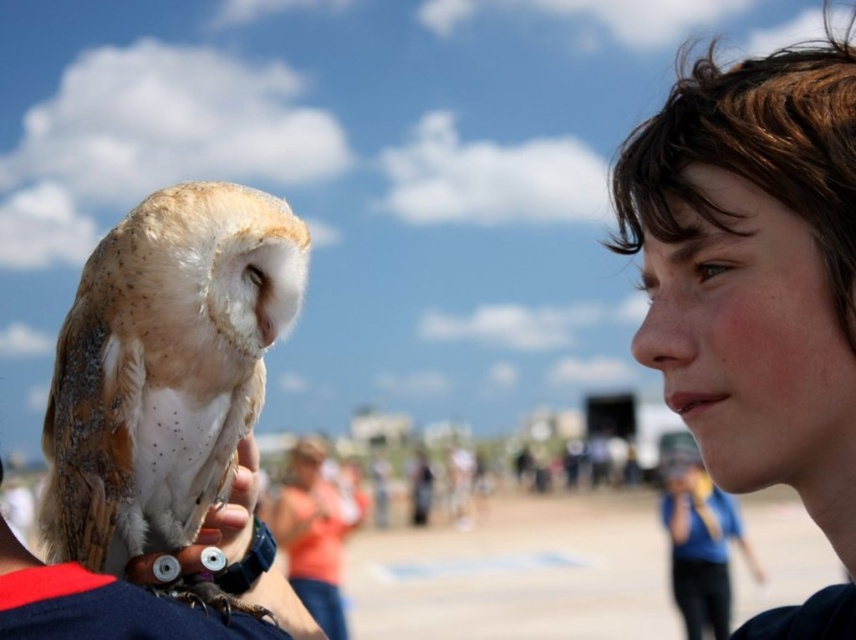
Is speckled feathered owl at left above blurred orange shirt at center?

Yes.

Which is in front, point (223, 323) or point (284, 516)?

Point (223, 323) is in front.

The image size is (856, 640). Identify the location of speckled feathered owl at left. (164, 368).